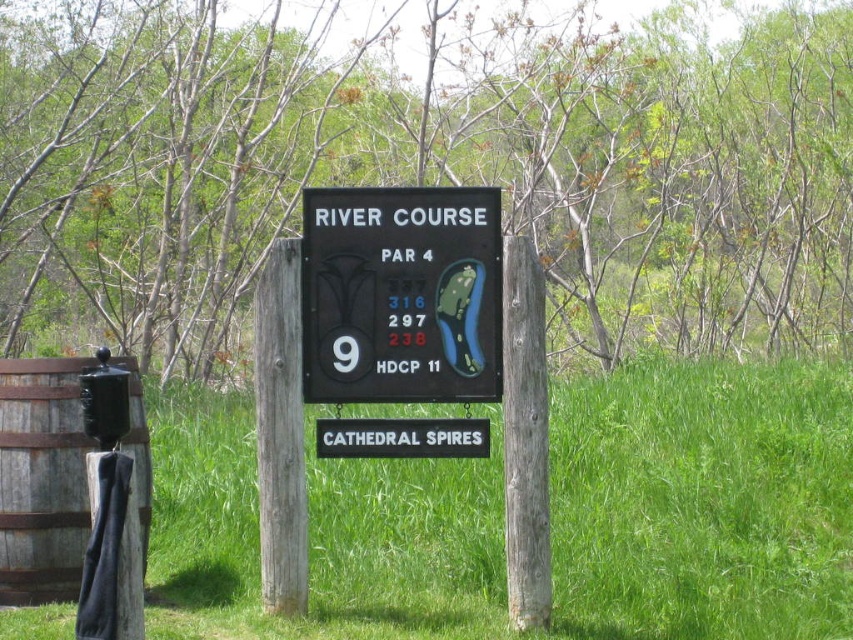
Does point (131, 374) lie behind point (525, 358)?

Yes, it is behind point (525, 358).

Based on the photo, is brown wooden barrel at left to the right of brown rough wood post at center from the viewer's perspective?

No, brown wooden barrel at left is not to the right of brown rough wood post at center.

Which is in front, point (33, 384) or point (505, 515)?

Positioned in front is point (505, 515).

At what (x,y) coordinates should I click in order to perform the action: click on brown wooden barrel at left. Please return your answer as a coordinate pair (x, y). The height and width of the screenshot is (640, 853). Looking at the image, I should click on click(x=42, y=480).

Is point (283, 460) closer to camera compared to point (462, 449)?

Yes, it is in front of point (462, 449).

Can you confirm if weathered wood post at center is positioned above white plastic sign at center?

Yes, weathered wood post at center is above white plastic sign at center.

Who is more distant from viewer, (262, 509) or (337, 436)?

The point (337, 436) is behind.

Where is `weathered wood post at center`? The image size is (853, 640). weathered wood post at center is located at coordinates (280, 432).

Does weathered wood post at center have a greater height compared to brown rough wood post at center?

In fact, weathered wood post at center may be shorter than brown rough wood post at center.

Can you confirm if weathered wood post at center is thinner than brown rough wood post at center?

In fact, weathered wood post at center might be wider than brown rough wood post at center.

Who is more forward, (x=293, y=548) or (x=520, y=582)?

Point (x=520, y=582)

I want to click on weathered wood post at center, so click(280, 432).